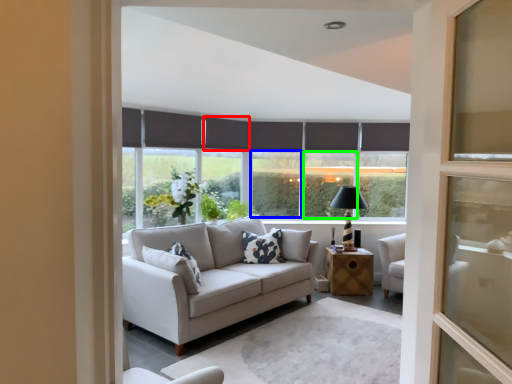
Question: Based on their relative distances, which object is nearer to curtain (highlighted by a red box)? Choose from window (highlighted by a blue box) and window (highlighted by a green box).

Choices:
 (A) window
 (B) window

Answer: (A)